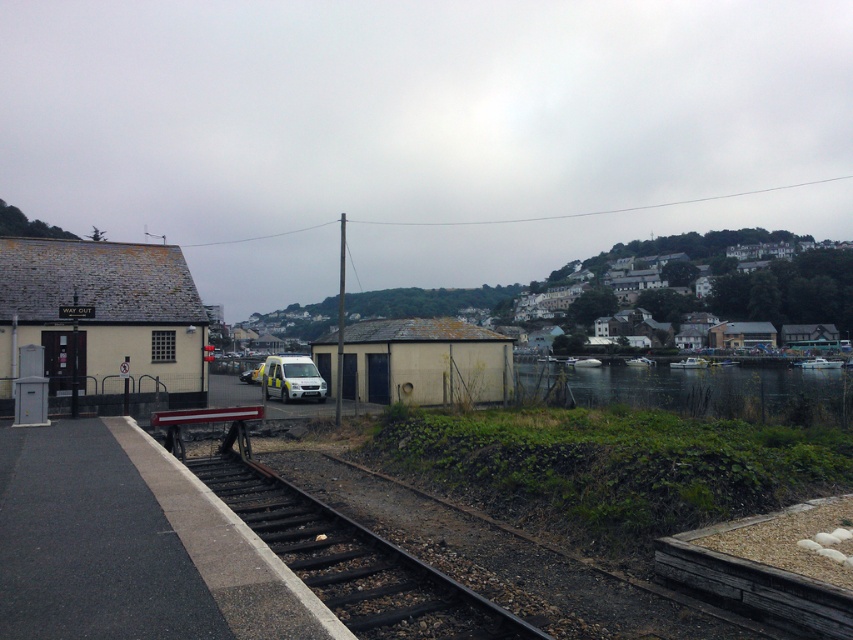
Who is positioned more to the right, black metal train track at lower center or white corrugated metal shed at center?

Positioned to the right is white corrugated metal shed at center.

Between black metal train track at lower center and white corrugated metal shed at center, which one is positioned lower?

black metal train track at lower center is lower down.

Where is `black metal train track at lower center`? Image resolution: width=853 pixels, height=640 pixels. black metal train track at lower center is located at coordinates (354, 563).

Consider the image. Can you confirm if green water at lower right is wider than white matte ambulance at center?

Yes, green water at lower right is wider than white matte ambulance at center.

Is point (793, 384) positioned after point (286, 380)?

Yes, point (793, 384) is behind point (286, 380).

Which is behind, point (575, 390) or point (283, 376)?

Positioned behind is point (283, 376).

Where is `green water at lower right`? The image size is (853, 640). green water at lower right is located at coordinates (718, 392).

Is matte yellow building at left further to camera compared to black metal train track at lower center?

Yes, it is.

Is point (6, 310) closer to camera compared to point (281, 490)?

No, it is behind (281, 490).

Is point (25, 316) more distant than point (381, 605)?

Yes, point (25, 316) is behind point (381, 605).

Image resolution: width=853 pixels, height=640 pixels. In order to click on matte yellow building at left in this screenshot , I will do tap(102, 320).